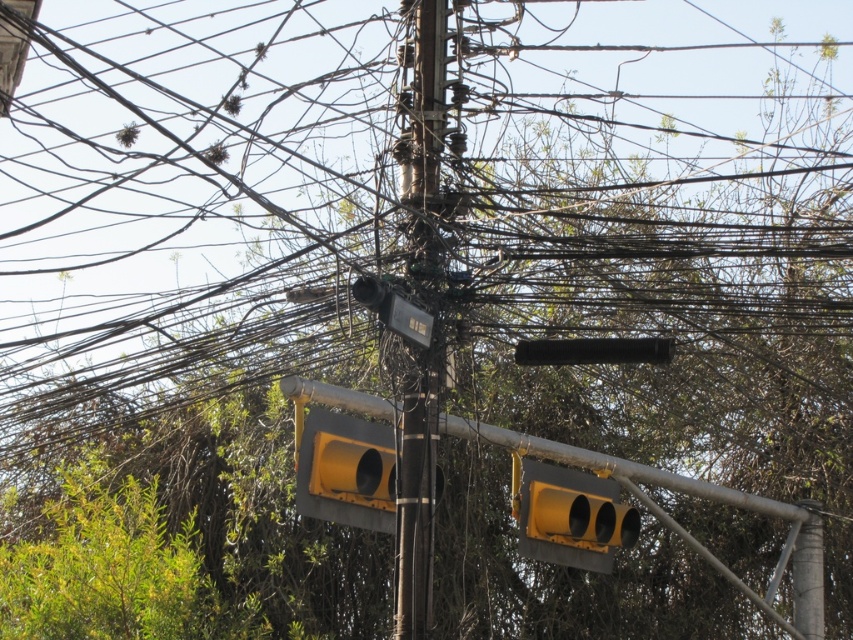
Question: Among these points, which one is nearest to the camera?

Choices:
 (A) (437, 275)
 (B) (604, 522)

Answer: (A)

Question: Is metallic pole at center above yellow matte traffic light at lower center?

Choices:
 (A) no
 (B) yes

Answer: (B)

Question: Is metallic pole at center wider than yellow matte traffic light at lower center?

Choices:
 (A) yes
 (B) no

Answer: (B)

Question: Can you confirm if metallic pole at center is bigger than yellow matte traffic light at lower center?

Choices:
 (A) no
 (B) yes

Answer: (A)

Question: Which of the following is the farthest from the observer?

Choices:
 (A) (584, 556)
 (B) (434, 92)

Answer: (A)